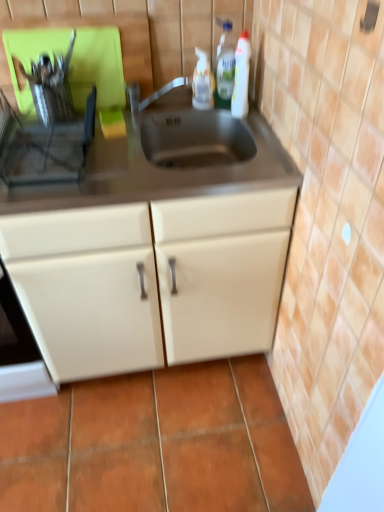
Locate an element on the screen. free space behind satin nickel faucet at center is located at coordinates (175, 105).